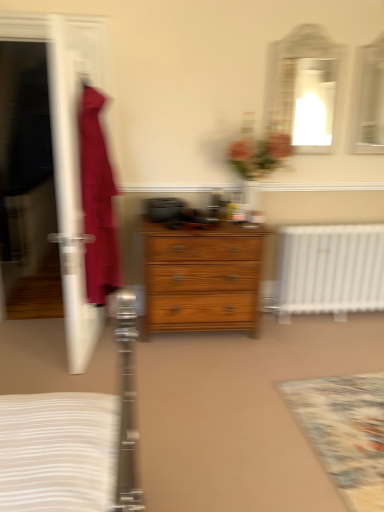
At what (x,y) coordinates should I click in order to perform the action: click on vacant space situated above matte white mirror at upper right, which is the 1th mirror in left-to-right order (from a real-world perspective). Please return your answer as a coordinate pair (x, y). Looking at the image, I should click on (305, 22).